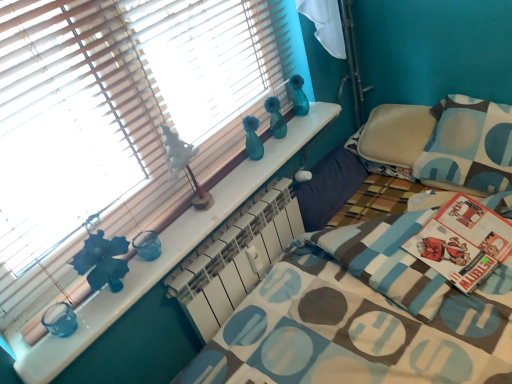
Question: From their relative heights in the image, would you say white matte radiator at center is taller or shorter than blue and white patterned pillow at right?

Choices:
 (A) tall
 (B) short

Answer: (B)

Question: Is white matte radiator at center wider or thinner than blue and white patterned pillow at right?

Choices:
 (A) thin
 (B) wide

Answer: (A)

Question: Estimate the real-world distances between objects in this image. Which object is closer to the wooden blinds at upper left?

Choices:
 (A) blue and white patterned pillow at right
 (B) white matte table lamp at upper center
 (C) white matte radiator at center

Answer: (B)

Question: Which object is positioned closest to the white matte table lamp at upper center?

Choices:
 (A) blue and white patterned pillow at right
 (B) white matte radiator at center
 (C) wooden blinds at upper left

Answer: (C)